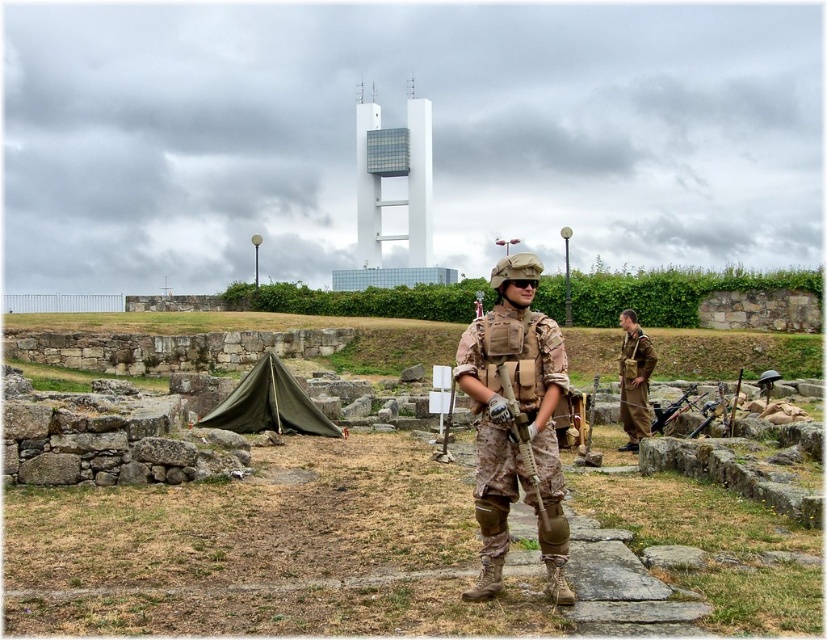
Is camouflage fabric uniform at center bigger than matte black rifle at center?

Yes.

What do you see at coordinates (509, 422) in the screenshot? I see `camouflage fabric uniform at center` at bounding box center [509, 422].

Is point (538, 456) positioned behind point (686, 394)?

No, (538, 456) is closer to viewer.

The image size is (827, 640). I want to click on camouflage fabric uniform at center, so click(x=509, y=422).

Which is behind, point (495, 561) or point (646, 396)?

The point (646, 396) is more distant.

Find the location of a particular element. camouflage fabric uniform at center is located at coordinates (509, 422).

The height and width of the screenshot is (640, 827). What do you see at coordinates (509, 422) in the screenshot?
I see `camouflage fabric uniform at center` at bounding box center [509, 422].

The height and width of the screenshot is (640, 827). Find the location of `camouflage fabric uniform at center`. camouflage fabric uniform at center is located at coordinates (509, 422).

Is camouflage fabric rifle at center above matte black rifle at center?

Yes, camouflage fabric rifle at center is above matte black rifle at center.

Who is more distant from viewer, (524, 451) or (653, 426)?

The point (653, 426) is more distant.

This screenshot has width=827, height=640. Identify the location of camouflage fabric rifle at center. (522, 440).